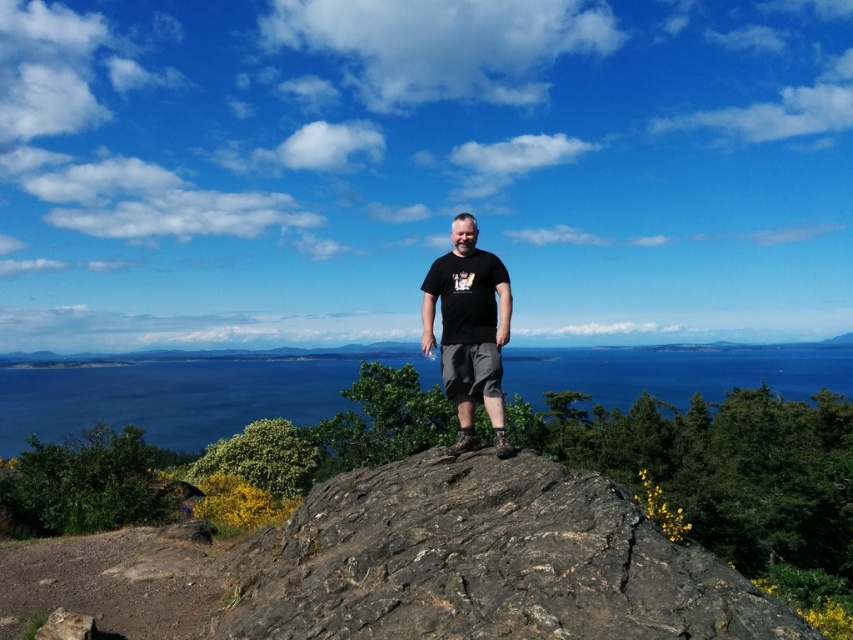
You are a hiker who wants to place a 10 cm wide GPS device on the rough textured rock at center. Can you determine if the rock is wide enough to hold the device?

The rough textured rock at center is located at point (485,563), but the description does not provide its dimensions. Therefore, it is impossible to determine if the rock is wide enough to hold the GPS device.